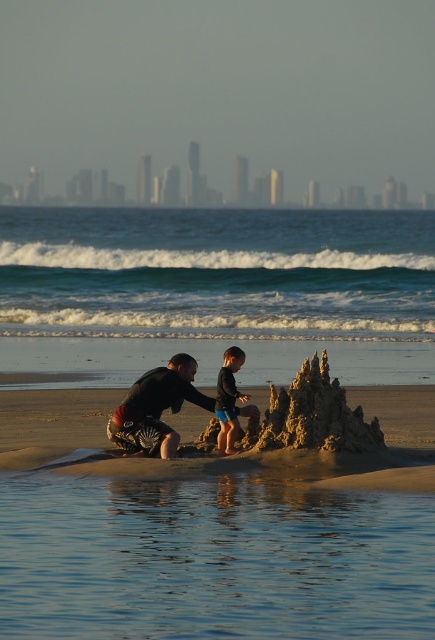
Is teal water at upper center bigger than golden sandcastle at center?

Correct, teal water at upper center is larger in size than golden sandcastle at center.

Which is below, teal water at upper center or golden sandcastle at center?

Positioned lower is golden sandcastle at center.

Does point (140, 332) come in front of point (303, 401)?

No, it is behind (303, 401).

Where is `teal water at upper center`? This screenshot has width=435, height=640. teal water at upper center is located at coordinates (216, 273).

Which is behind, point (66, 324) or point (29, 392)?

Positioned behind is point (66, 324).

From the picture: Can you confirm if teal water at upper center is positioned below brown sandy beach at center?

No, teal water at upper center is not below brown sandy beach at center.

Is point (57, 328) farther from camera compared to point (387, 440)?

Yes, point (57, 328) is behind point (387, 440).

The image size is (435, 640). In order to click on teal water at upper center in this screenshot , I will do `click(216, 273)`.

Can you confirm if brown sandy beach at center is positioned below golden sandcastle at center?

Yes, brown sandy beach at center is below golden sandcastle at center.

How far apart are brown sandy beach at center and golden sandcastle at center?

brown sandy beach at center is 6.02 feet away from golden sandcastle at center.

This screenshot has height=640, width=435. Identify the location of brown sandy beach at center. (324, 452).

Where is `brown sandy beach at center`? brown sandy beach at center is located at coordinates (324, 452).